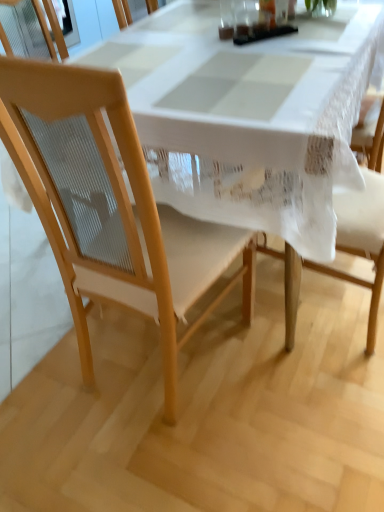
Find the location of a particular element. The image size is (384, 512). vacant space to the right of light wood chair at center is located at coordinates (288, 381).